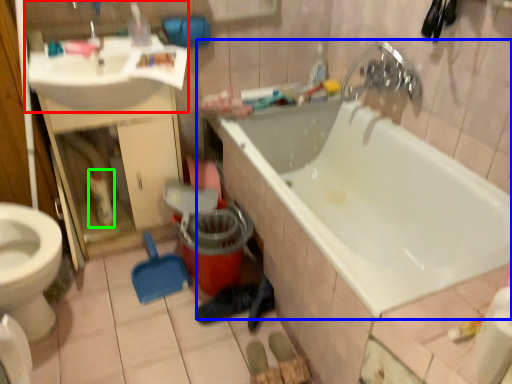
Question: Based on their relative distances, which object is nearer to sink (highlighted by a red box)? Choose from bathtub (highlighted by a blue box) and cleaning product (highlighted by a green box).

Choices:
 (A) bathtub
 (B) cleaning product

Answer: (B)